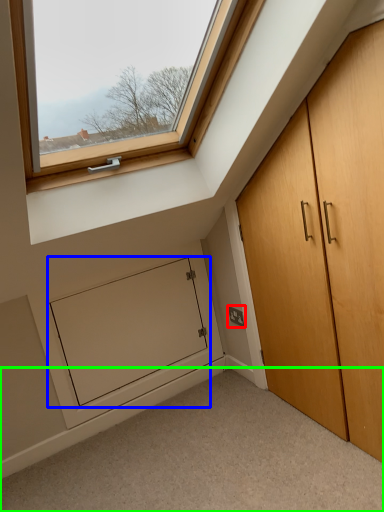
Question: Based on their relative distances, which object is farther from electric outlet (highlighted by a red box)? Choose from screen door (highlighted by a blue box) and corridor (highlighted by a green box).

Choices:
 (A) screen door
 (B) corridor

Answer: (B)